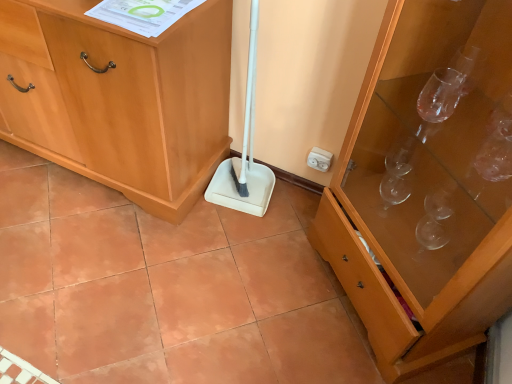
Locate an element on the screen. white plastic electric outlet at upper right is located at coordinates (319, 159).

Is there a large distance between terracotta ceramic tile at center and white plastic shovel at center?

They are positioned close to each other.

Between terracotta ceramic tile at center and white plastic shovel at center, which one has larger width?

terracotta ceramic tile at center is wider.

Does point (38, 159) lie in front of point (262, 174)?

Yes, point (38, 159) is closer to viewer.

Which object is thinner, white plastic shovel at center or terracotta ceramic tile at center?

With smaller width is white plastic shovel at center.

Is white plastic shovel at center with terracotta ceramic tile at center?

They are not placed beside each other.

Could you tell me if white plastic shovel at center is turned towards terracotta ceramic tile at center?

Yes, white plastic shovel at center is oriented towards terracotta ceramic tile at center.

Is light wood cabinet at center, placed as the 2th cabinetry when sorted from right to left, wider than white plastic shovel at center?

Yes.

From the picture: Which point is more distant from viewer, (203, 136) or (261, 190)?

The point (261, 190) is farther.

Does light wood cabinet at center, placed as the first cabinetry when sorted from left to right, appear on the right side of white plastic shovel at center?

In fact, light wood cabinet at center, placed as the first cabinetry when sorted from left to right, is to the left of white plastic shovel at center.

From their relative heights in the image, would you say terracotta ceramic tile at center is taller or shorter than white plastic electric outlet at upper right?

In the image, terracotta ceramic tile at center appears to be shorter than white plastic electric outlet at upper right.

Which of these two, terracotta ceramic tile at center or white plastic electric outlet at upper right, is smaller?

white plastic electric outlet at upper right is smaller.

Measure the distance from terracotta ceramic tile at center to white plastic electric outlet at upper right.

29.53 inches.

Can you tell me how much terracotta ceramic tile at center and white plastic electric outlet at upper right differ in facing direction?

The angle between the facing direction of terracotta ceramic tile at center and the facing direction of white plastic electric outlet at upper right is 92.3 degrees.

Do you think transparent glass cabinet at right, which ranks as the second cabinetry in left-to-right order, is within white plastic electric outlet at upper right, or outside of it?

transparent glass cabinet at right, which ranks as the second cabinetry in left-to-right order, lies outside white plastic electric outlet at upper right.

Which is nearer, (412, 51) or (319, 162)?

The point (412, 51) is more forward.

Between transparent glass cabinet at right, acting as the first cabinetry starting from the right, and white plastic electric outlet at upper right, which one has smaller width?

white plastic electric outlet at upper right is thinner.

Visually, is white plastic electric outlet at upper right positioned to the left or to the right of terracotta ceramic tile at center?

white plastic electric outlet at upper right is positioned on terracotta ceramic tile at center's right side.

Is white plastic electric outlet at upper right facing away from terracotta ceramic tile at center?

No, white plastic electric outlet at upper right is not facing away from terracotta ceramic tile at center.

Which is correct: white plastic electric outlet at upper right is inside terracotta ceramic tile at center, or outside of it?

white plastic electric outlet at upper right cannot be found inside terracotta ceramic tile at center.

Does point (319, 155) appear closer or farther from the camera than point (115, 301)?

Point (319, 155) is farther from the camera than point (115, 301).

From a real-world perspective, which is physically above, white plastic shovel at center or white plastic electric outlet at upper right?

white plastic shovel at center is physically above.

Is white plastic shovel at center bigger than white plastic electric outlet at upper right?

Yes, white plastic shovel at center is bigger than white plastic electric outlet at upper right.

Find the location of a particular element. electric outlet beneath the white plastic shovel at center (from a real-world perspective) is located at coordinates (319, 159).

Locate an element on the screen. shovel lying above the terracotta ceramic tile at center (from the image's perspective) is located at coordinates (244, 153).

This screenshot has width=512, height=384. What are the coordinates of `shovel that is above the terracotta ceramic tile at center (from a real-world perspective)` in the screenshot? It's located at (x=244, y=153).

Considering their positions, is transparent glass cabinet at right, which ranks as the second cabinetry in left-to-right order, positioned closer to white plastic shovel at center than terracotta ceramic tile at center?

Based on the image, terracotta ceramic tile at center appears to be nearer to white plastic shovel at center.

Considering their positions, is transparent glass cabinet at right, acting as the first cabinetry starting from the right, positioned further to terracotta ceramic tile at center than white plastic electric outlet at upper right?

white plastic electric outlet at upper right.

Estimate the real-world distances between objects in this image. Which object is closer to light wood cabinet at center, placed as the 2th cabinetry when sorted from right to left, transparent glass cabinet at right, acting as the first cabinetry starting from the right, or white plastic shovel at center?

Based on the image, white plastic shovel at center appears to be nearer to light wood cabinet at center, placed as the 2th cabinetry when sorted from right to left.

In the scene shown: When comparing their distances from white plastic shovel at center, does light wood cabinet at center, placed as the first cabinetry when sorted from left to right, or terracotta ceramic tile at center seem closer?

Among the two, light wood cabinet at center, placed as the first cabinetry when sorted from left to right, is located nearer to white plastic shovel at center.

From the image, which object appears to be farther from transparent glass cabinet at right, acting as the first cabinetry starting from the right, terracotta ceramic tile at center or white plastic electric outlet at upper right?

Among the two, white plastic electric outlet at upper right is located further to transparent glass cabinet at right, acting as the first cabinetry starting from the right.

From the image, which object appears to be farther from white plastic shovel at center, white plastic electric outlet at upper right or light wood cabinet at center, placed as the first cabinetry when sorted from left to right?

The object further to white plastic shovel at center is light wood cabinet at center, placed as the first cabinetry when sorted from left to right.

Considering their positions, is white plastic shovel at center positioned closer to terracotta ceramic tile at center than transparent glass cabinet at right, acting as the first cabinetry starting from the right?

white plastic shovel at center is positioned closer to the anchor terracotta ceramic tile at center.

Looking at the image, which one is located closer to terracotta ceramic tile at center, light wood cabinet at center, placed as the first cabinetry when sorted from left to right, or transparent glass cabinet at right, acting as the first cabinetry starting from the right?

light wood cabinet at center, placed as the first cabinetry when sorted from left to right, is closer to terracotta ceramic tile at center.

Locate an element on the screen. This screenshot has width=512, height=384. shovel between light wood cabinet at center, placed as the 2th cabinetry when sorted from right to left, and transparent glass cabinet at right, which ranks as the second cabinetry in left-to-right order, in the horizontal direction is located at coordinates (244, 153).

The image size is (512, 384). Identify the location of ceramic tile between transparent glass cabinet at right, which ranks as the second cabinetry in left-to-right order, and white plastic electric outlet at upper right, along the z-axis. (167, 288).

Locate an element on the screen. The width and height of the screenshot is (512, 384). shovel between terracotta ceramic tile at center and transparent glass cabinet at right, which ranks as the second cabinetry in left-to-right order, in the horizontal direction is located at coordinates (244, 153).

Where is `electric outlet between light wood cabinet at center, placed as the 2th cabinetry when sorted from right to left, and transparent glass cabinet at right, which ranks as the second cabinetry in left-to-right order`? electric outlet between light wood cabinet at center, placed as the 2th cabinetry when sorted from right to left, and transparent glass cabinet at right, which ranks as the second cabinetry in left-to-right order is located at coordinates click(x=319, y=159).